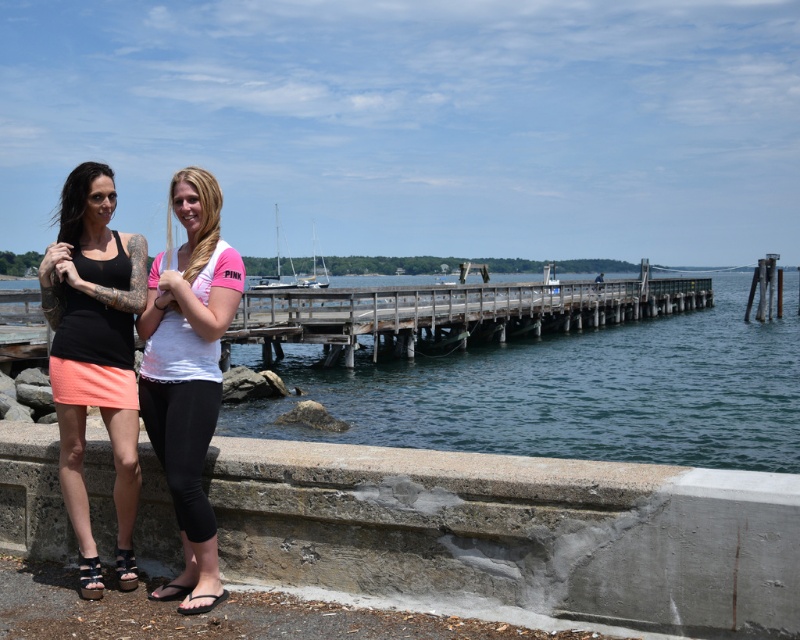
You are standing at the point closest to the wooden pier. Which point, point (66, 296) or point (186, 570), is farther away from you?

Point (66, 296) is farther away because it is behind point (186, 570), which means it is located further back in the scene.

You are standing on the concrete ledge and want to take a photo of the clear blue water at center and the wooden at center. Which object will appear larger in the photo?

The clear blue water at center will appear larger in the photo because it is closer to the viewer than the wooden at center.